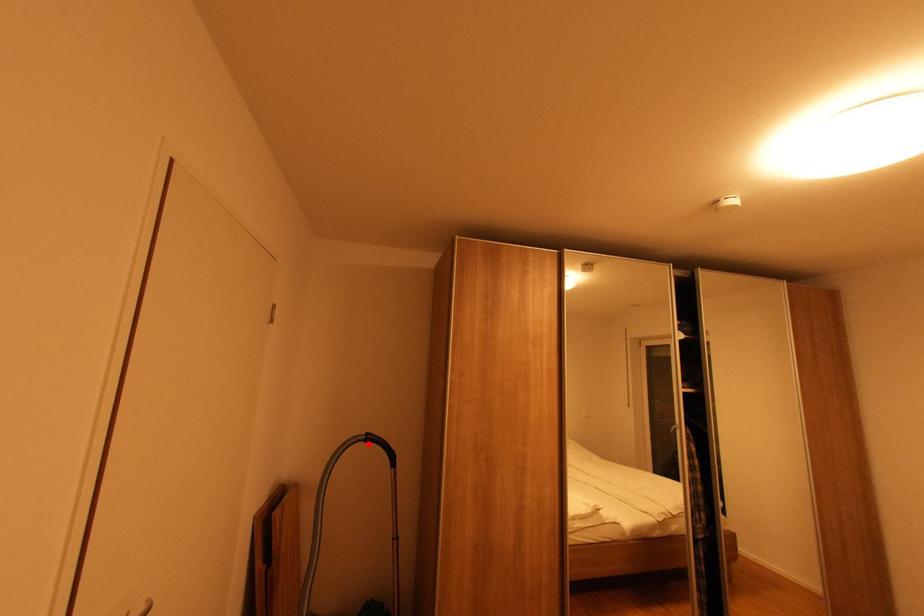
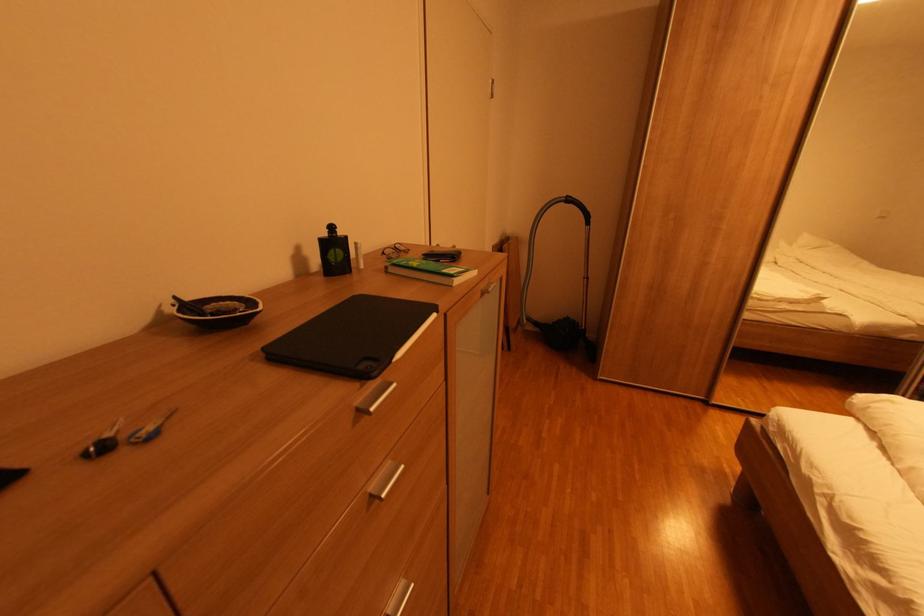
Where in the second image is the point corresponding to the highlighted location from the first image?

(568, 205)